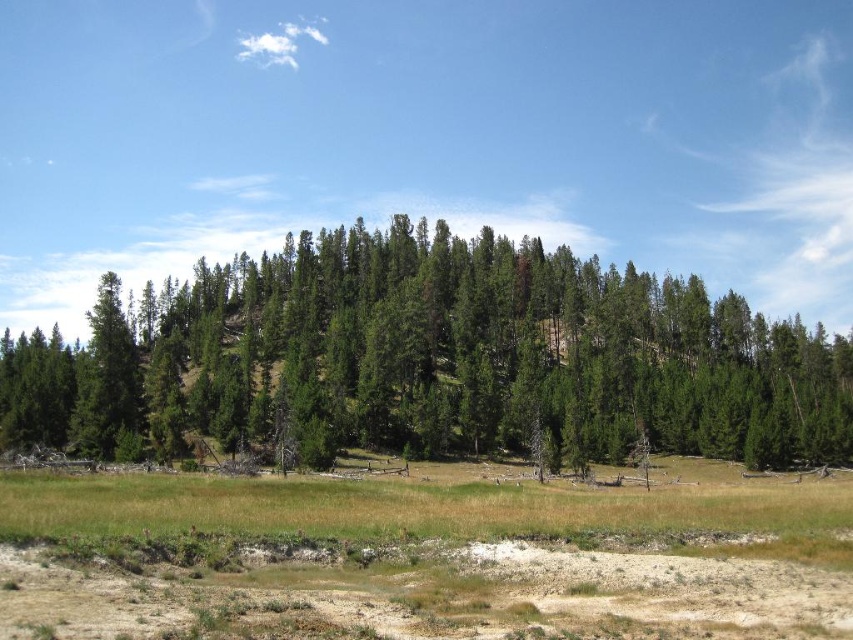
You are a hiker standing in the forest and want to reach the brown sandy dirt field at lower center. Which direction should you move relative to the green matte trees at center?

The green matte trees at center are closer to you than the brown sandy dirt field at lower center. To reach the field, you should move away from the green matte trees at center.

You are planning to build a small garden in the brown sandy dirt field at lower center. Considering the size of the green matte trees at center, will the garden have enough space to grow vegetables?

The green matte trees at center are larger in size than the brown sandy dirt field at lower center, so the available space in the brown sandy dirt field at lower center may be limited, potentially making it challenging to grow a substantial vegetable garden.